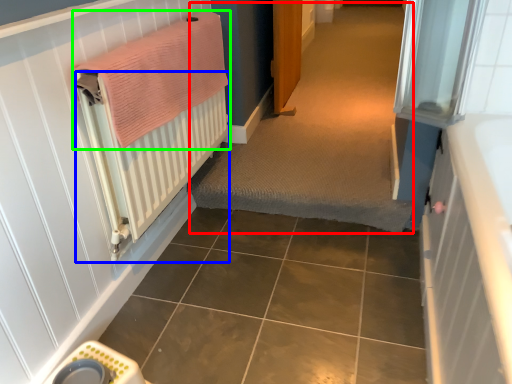
Question: Which object is positioned farthest from plain (highlighted by a red box)? Select from radiator (highlighted by a blue box) and bath towel (highlighted by a green box).

Choices:
 (A) radiator
 (B) bath towel

Answer: (B)